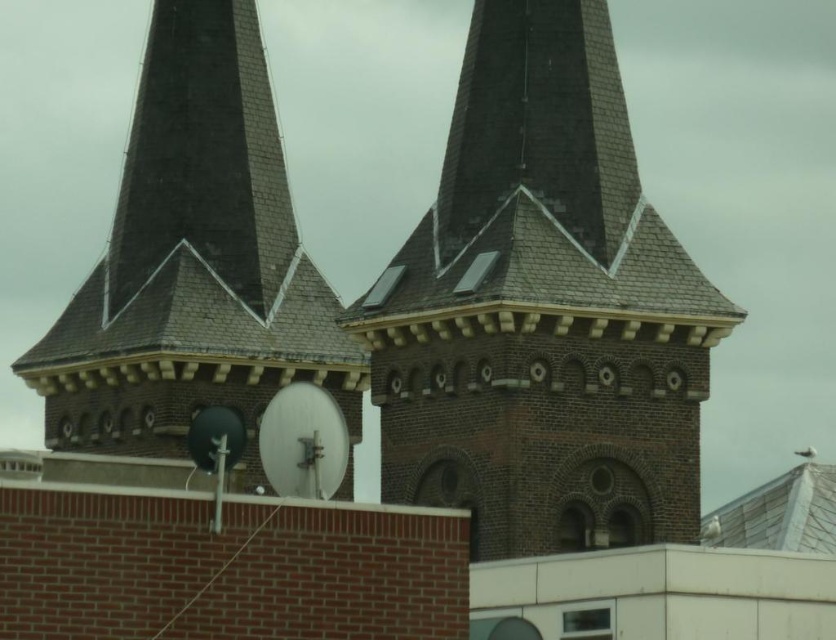
Who is positioned more to the left, brown brick tower at center or dark gray shingles at center?

From the viewer's perspective, dark gray shingles at center appears more on the left side.

Describe the element at coordinates (543, 308) in the screenshot. This screenshot has width=836, height=640. I see `brown brick tower at center` at that location.

Between point (610, 209) and point (230, 147), which one is positioned in front?

Point (610, 209) is more forward.

Find the location of `brown brick tower at center`. brown brick tower at center is located at coordinates (543, 308).